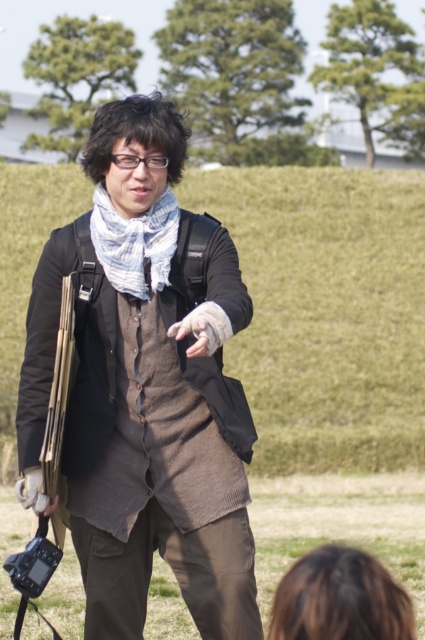
Question: Considering the real-world distances, which object is closest to the knitted brown vest at center?

Choices:
 (A) white textured scarf at center
 (B) leather glove at center

Answer: (B)

Question: Which point is closer to the camera taking this photo?

Choices:
 (A) (184, 323)
 (B) (152, 221)
 (C) (220, 273)

Answer: (A)

Question: Does knitted brown vest at center appear under white textured scarf at center?

Choices:
 (A) no
 (B) yes

Answer: (B)

Question: Does white textured scarf at center have a larger size compared to leather glove at center?

Choices:
 (A) yes
 (B) no

Answer: (A)

Question: Estimate the real-world distances between objects in this image. Which object is closer to the white textured scarf at center?

Choices:
 (A) knitted brown vest at center
 (B) leather glove at center

Answer: (A)

Question: Can you confirm if knitted brown vest at center is bigger than leather glove at center?

Choices:
 (A) yes
 (B) no

Answer: (A)